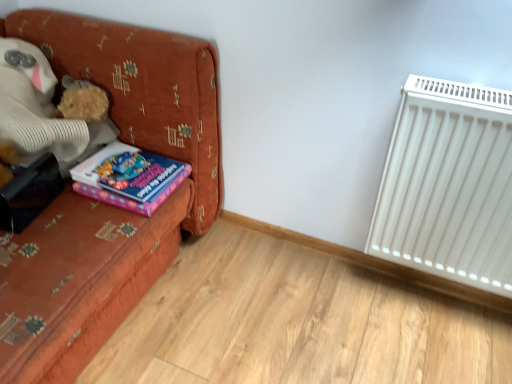
Question: Is velvet orange couch at left shorter than purple matte book at left?

Choices:
 (A) no
 (B) yes

Answer: (A)

Question: Is velvet orange couch at left surrounding purple matte book at left?

Choices:
 (A) yes
 (B) no

Answer: (A)

Question: Is velvet orange couch at left positioned before purple matte book at left?

Choices:
 (A) yes
 (B) no

Answer: (A)

Question: Is velvet orange couch at left outside of purple matte book at left?

Choices:
 (A) no
 (B) yes

Answer: (B)

Question: Considering the relative sizes of velvet orange couch at left and purple matte book at left in the image provided, is velvet orange couch at left taller than purple matte book at left?

Choices:
 (A) yes
 (B) no

Answer: (A)

Question: Is velvet orange couch at left positioned with its back to purple matte book at left?

Choices:
 (A) yes
 (B) no

Answer: (A)

Question: Does fluffy beige teddy bear at left have a lesser width compared to purple matte book at left?

Choices:
 (A) no
 (B) yes

Answer: (A)

Question: Does fluffy beige teddy bear at left lie in front of purple matte book at left?

Choices:
 (A) no
 (B) yes

Answer: (B)

Question: Could you tell me if fluffy beige teddy bear at left is turned towards purple matte book at left?

Choices:
 (A) yes
 (B) no

Answer: (A)

Question: Is fluffy beige teddy bear at left looking in the opposite direction of purple matte book at left?

Choices:
 (A) yes
 (B) no

Answer: (B)

Question: From a real-world perspective, is fluffy beige teddy bear at left physically above purple matte book at left?

Choices:
 (A) no
 (B) yes

Answer: (B)

Question: From the image's perspective, is fluffy beige teddy bear at left beneath purple matte book at left?

Choices:
 (A) yes
 (B) no

Answer: (B)

Question: From a real-world perspective, is fluffy beige teddy bear at left physically below white plastic radiator at right?

Choices:
 (A) no
 (B) yes

Answer: (A)